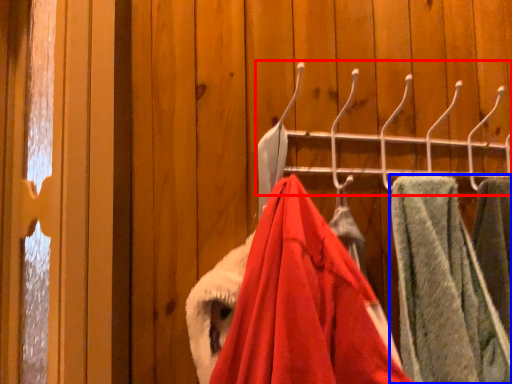
Question: Among these objects, which one is farthest to the camera, closet (highlighted by a red box) or towel (highlighted by a blue box)?

Choices:
 (A) closet
 (B) towel

Answer: (A)